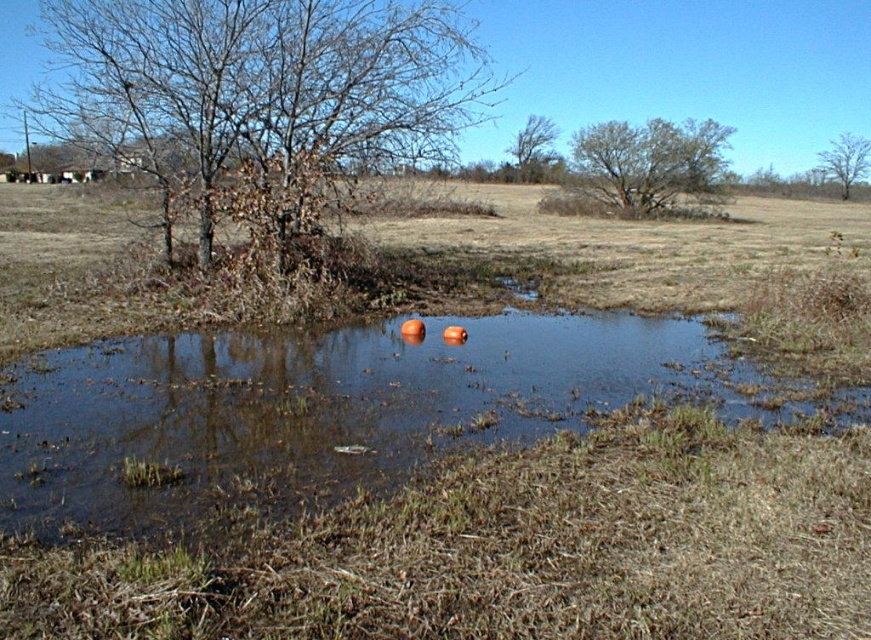
Based on the photo, is green leafy tree at upper center smaller than bare wood tree at upper right?

Actually, green leafy tree at upper center might be larger than bare wood tree at upper right.

Between green leafy tree at upper center and bare wood tree at upper right, which one has less height?

bare wood tree at upper right is shorter.

What do you see at coordinates (647, 163) in the screenshot? I see `green leafy tree at upper center` at bounding box center [647, 163].

Locate an element on the screen. This screenshot has height=640, width=871. green leafy tree at upper center is located at coordinates (647, 163).

Does translucent water at center have a smaller size compared to green leafy tree at upper center?

Yes.

Which of these two, translucent water at center or green leafy tree at upper center, stands shorter?

Standing shorter between the two is translucent water at center.

The image size is (871, 640). What do you see at coordinates (325, 406) in the screenshot?
I see `translucent water at center` at bounding box center [325, 406].

At what (x,y) coordinates should I click in order to perform the action: click on translucent water at center. Please return your answer as a coordinate pair (x, y). Looking at the image, I should click on (325, 406).

Does brown/dried bark tree at upper left appear over brown textured tree at upper center?

Correct, brown/dried bark tree at upper left is located above brown textured tree at upper center.

Is the position of brown/dried bark tree at upper left more distant than that of brown textured tree at upper center?

No.

The width and height of the screenshot is (871, 640). What do you see at coordinates (262, 81) in the screenshot? I see `brown/dried bark tree at upper left` at bounding box center [262, 81].

The width and height of the screenshot is (871, 640). Identify the location of brown/dried bark tree at upper left. (262, 81).